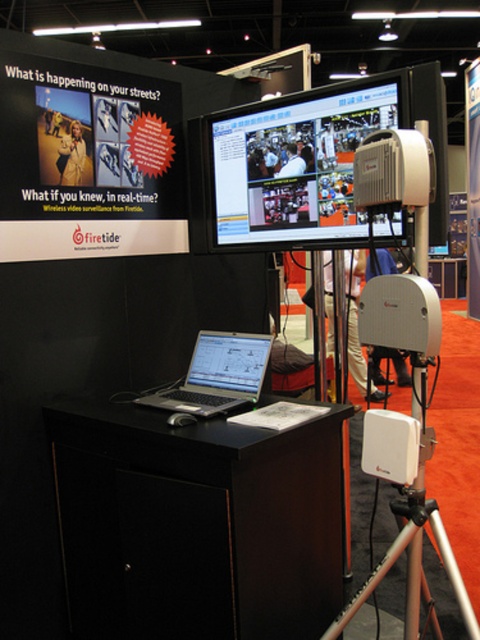
Between satin silver laptop at center and white plastic projector at center, which one has more height?

satin silver laptop at center is taller.

Does satin silver laptop at center lie behind white plastic projector at center?

That is True.

Which is behind, point (232, 349) or point (391, 136)?

The point (232, 349) is more distant.

Where is `satin silver laptop at center`? The width and height of the screenshot is (480, 640). satin silver laptop at center is located at coordinates (217, 374).